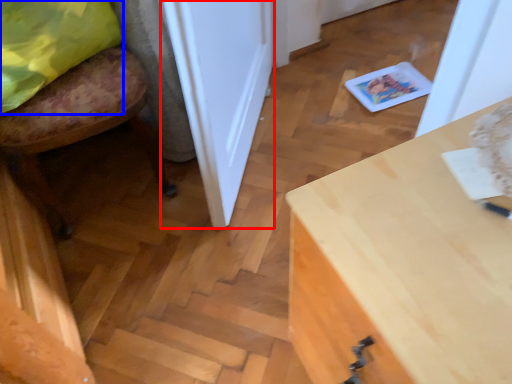
Question: Which of the following is the farthest to the observer, door (highlighted by a red box) or pillow (highlighted by a blue box)?

Choices:
 (A) door
 (B) pillow

Answer: (B)